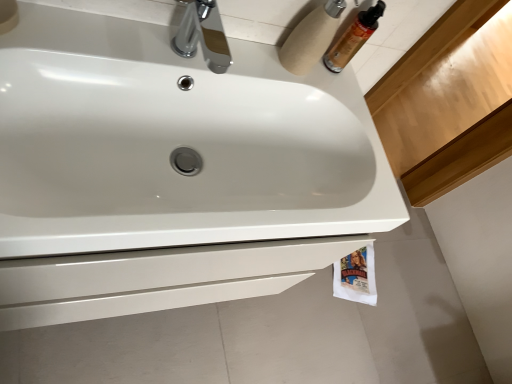
The height and width of the screenshot is (384, 512). Find the location of `vacant space behind chrome metallic faucet at upper center`. vacant space behind chrome metallic faucet at upper center is located at coordinates (239, 47).